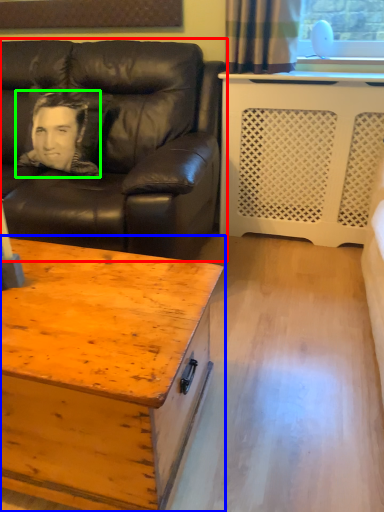
Question: Considering the real-world distances, which object is closest to studio couch (highlighted by a red box)? coffee table (highlighted by a blue box) or man (highlighted by a green box).

Choices:
 (A) coffee table
 (B) man

Answer: (B)